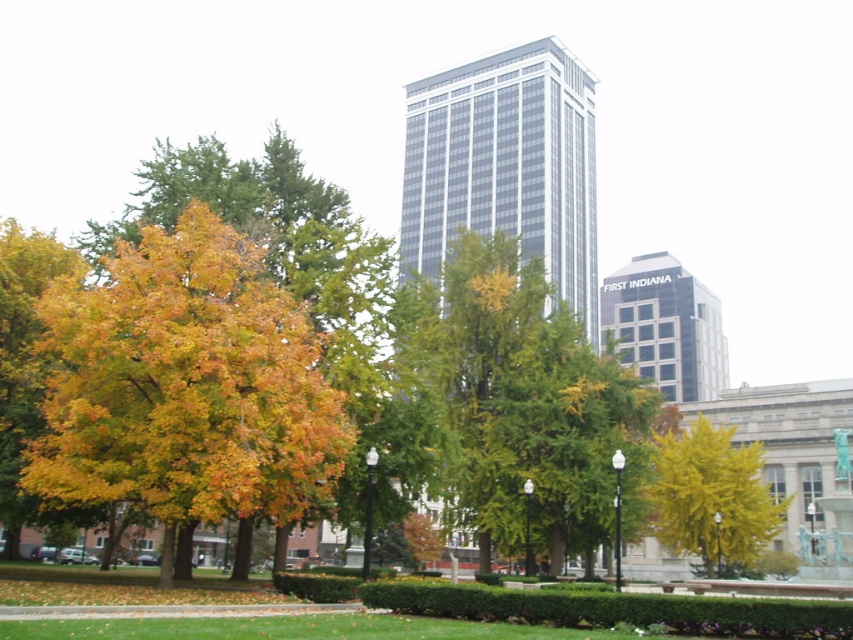
Consider the image. You are standing in the urban park and want to take a photo of both the golden yellow leaves at left and the green leafy tree at center. Which object should you focus on first to ensure both are in the frame?

To ensure both the golden yellow leaves at left and the green leafy tree at center are in focus, you should focus on the golden yellow leaves at left first since it is closer to the viewer, allowing the tree in the center to fall within the depth of field.